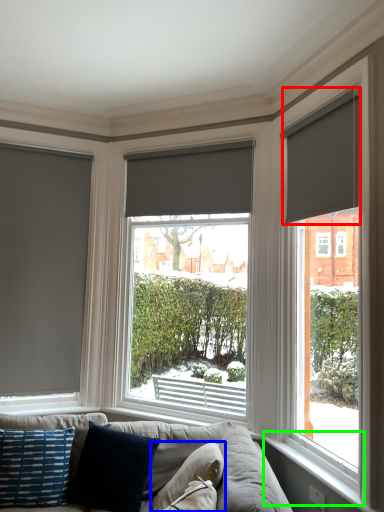
Question: Which object is the closest to the window blind (highlighted by a red box)? Choose among these: pillow (highlighted by a blue box) or window sill (highlighted by a green box).

Choices:
 (A) pillow
 (B) window sill

Answer: (B)